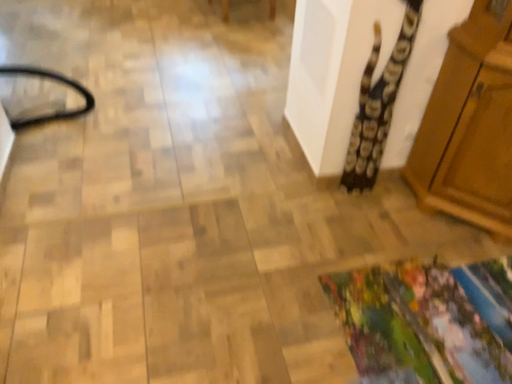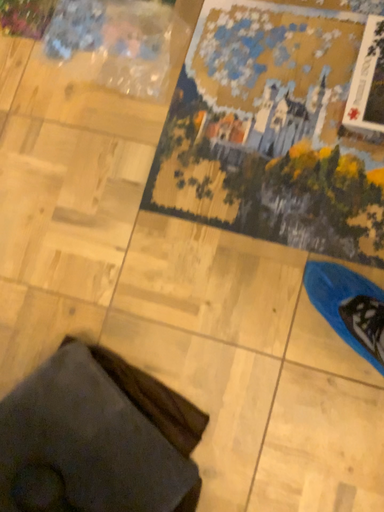
Question: How did the camera likely rotate when shooting the video?

Choices:
 (A) rotated right
 (B) rotated left

Answer: (A)